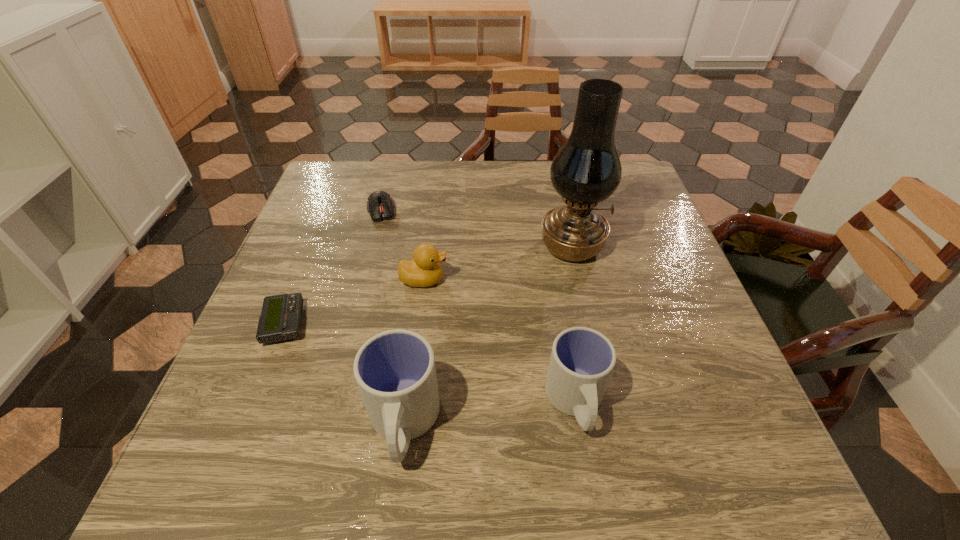
Where is `vacant space at the far left corner of the desktop`? Image resolution: width=960 pixels, height=540 pixels. vacant space at the far left corner of the desktop is located at coordinates (366, 174).

Find the location of a particular element. The width and height of the screenshot is (960, 540). vacant area that lies between the tallest object and the third shortest object is located at coordinates (497, 263).

Identify the location of vacant space in between the shortest object and the fourth tallest object. (354, 301).

Locate an element on the screen. This screenshot has width=960, height=540. empty space between the shortest object and the duckling is located at coordinates (354, 301).

This screenshot has height=540, width=960. In order to click on vacant area that lies between the duckling and the fourth farthest object in this screenshot , I will do `click(354, 301)`.

I want to click on free spot between the taller cup and the tallest object, so click(x=488, y=335).

Locate an element on the screen. The height and width of the screenshot is (540, 960). vacant space that's between the fourth tallest object and the fourth shortest object is located at coordinates (499, 341).

Find the location of a particular element. This screenshot has width=960, height=540. free space that is in between the duckling and the oil lamp is located at coordinates (x=497, y=263).

Select which object is the third closest to the left cup. Please provide its 2D coordinates. Your answer should be formatted as a tuple, i.e. [(x, y)], where the tuple contains the x and y coordinates of a point satisfying the conditions above.

[(424, 270)]

Select which object is the third closest to the fifth object from right to left. Please provide its 2D coordinates. Your answer should be formatted as a tuple, i.e. [(x, y)], where the tuple contains the x and y coordinates of a point satisfying the conditions above.

[(587, 170)]